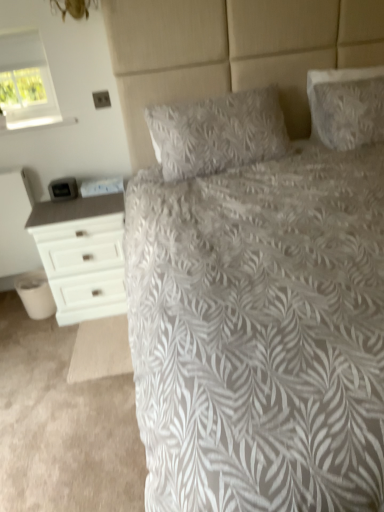
Question: Is white painted wood nightstand at left wider or thinner than white textured bed at center?

Choices:
 (A) wide
 (B) thin

Answer: (B)

Question: Is point (23, 265) positioned closer to the camera than point (344, 146)?

Choices:
 (A) closer
 (B) farther

Answer: (B)

Question: Which object is positioned closest to the white textured pillow at center, positioned as the 1th pillow in left-to-right order?

Choices:
 (A) white textured pillow at upper right, the second pillow positioned from the left
 (B) white textured bed at center
 (C) white painted wood nightstand at left
 (D) white wood chest of drawers at left
 (E) white fabric window at upper left

Answer: (A)

Question: Which object is positioned closest to the white textured bed at center?

Choices:
 (A) white textured pillow at upper right, the second pillow positioned from the left
 (B) white fabric window at upper left
 (C) white painted wood nightstand at left
 (D) white wood chest of drawers at left
 (E) white textured pillow at center, positioned as the 1th pillow in left-to-right order

Answer: (E)